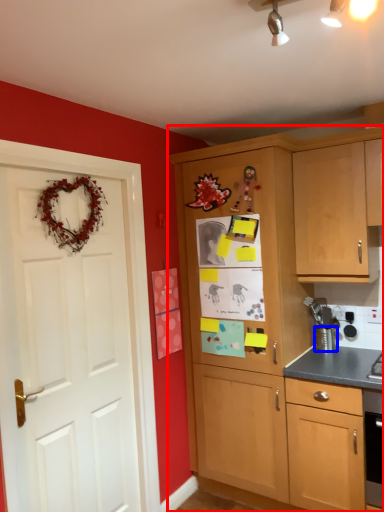
Question: Which point is closer to the camera, cabinetry (highlighted by a red box) or appliance (highlighted by a blue box)?

Choices:
 (A) cabinetry
 (B) appliance

Answer: (A)